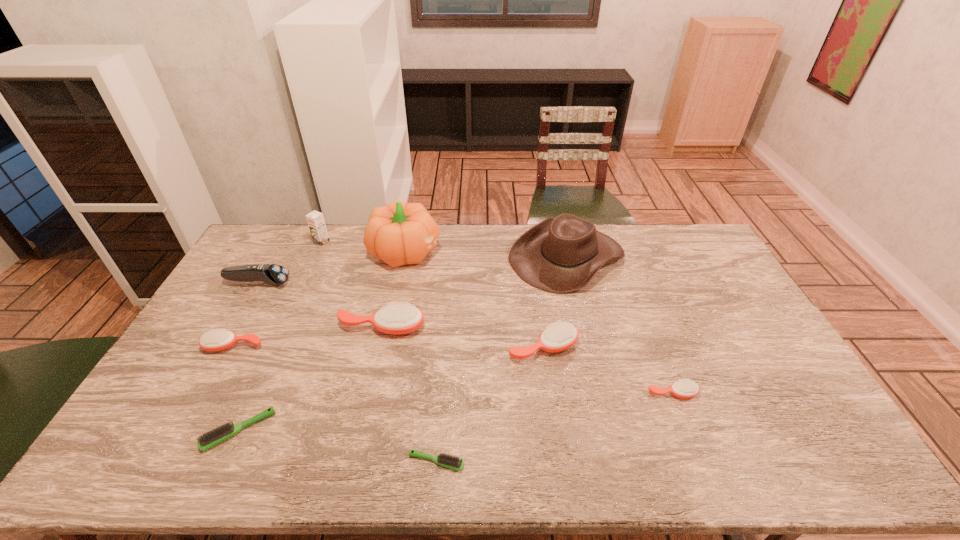
Image resolution: width=960 pixels, height=540 pixels. I want to click on the rightmost orange hairbrush, so click(x=685, y=389).

Find the location of a particular element. the third nearest hairbrush is located at coordinates (685, 389).

This screenshot has width=960, height=540. In order to click on the bigger light hairbrush in this screenshot , I will do `click(209, 439)`.

Where is `the left light hairbrush`? the left light hairbrush is located at coordinates (209, 439).

Image resolution: width=960 pixels, height=540 pixels. Find the location of `the smaller light hairbrush`. the smaller light hairbrush is located at coordinates (445, 460).

I want to click on the shortest hairbrush, so click(x=445, y=460).

Where is `free space located 0.070m on the carved face of the tallest object`? This screenshot has width=960, height=540. free space located 0.070m on the carved face of the tallest object is located at coordinates (460, 252).

This screenshot has width=960, height=540. What are the coordinates of `vacant space situated 0.290m on the left of the cowboy hat` in the screenshot? It's located at (431, 256).

Where is `free location located on the front of the chocolate milk`? The width and height of the screenshot is (960, 540). free location located on the front of the chocolate milk is located at coordinates (289, 313).

Locate an element on the screen. The image size is (960, 540). free region located 0.340m on the head of the electric shaver is located at coordinates (387, 283).